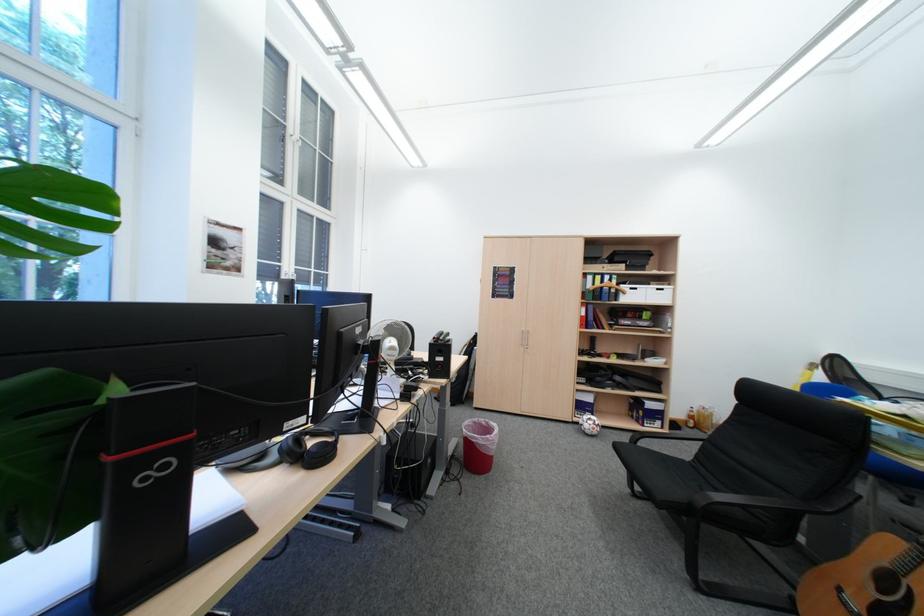
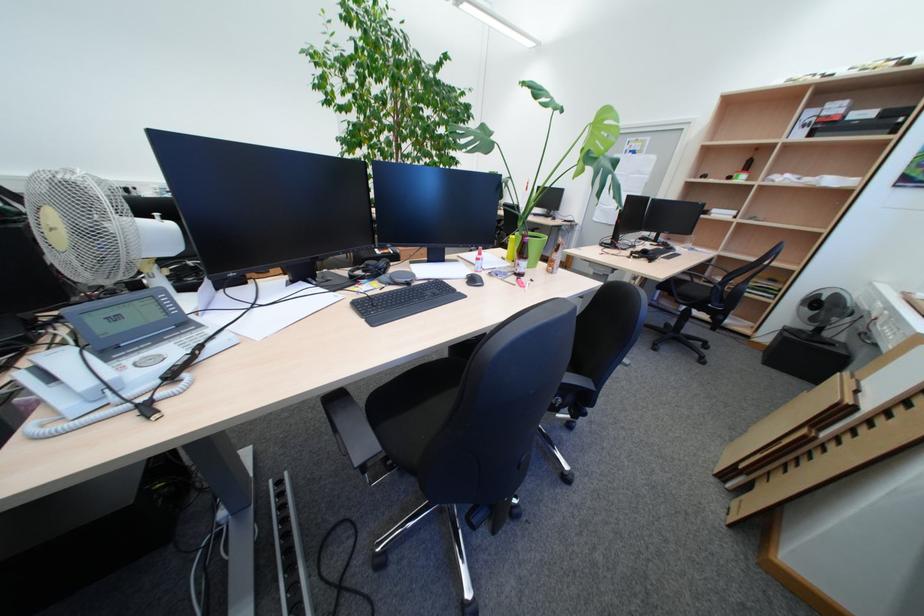
Find the pixel in the second image that matches the point at 361,586 in the first image.

(338, 439)